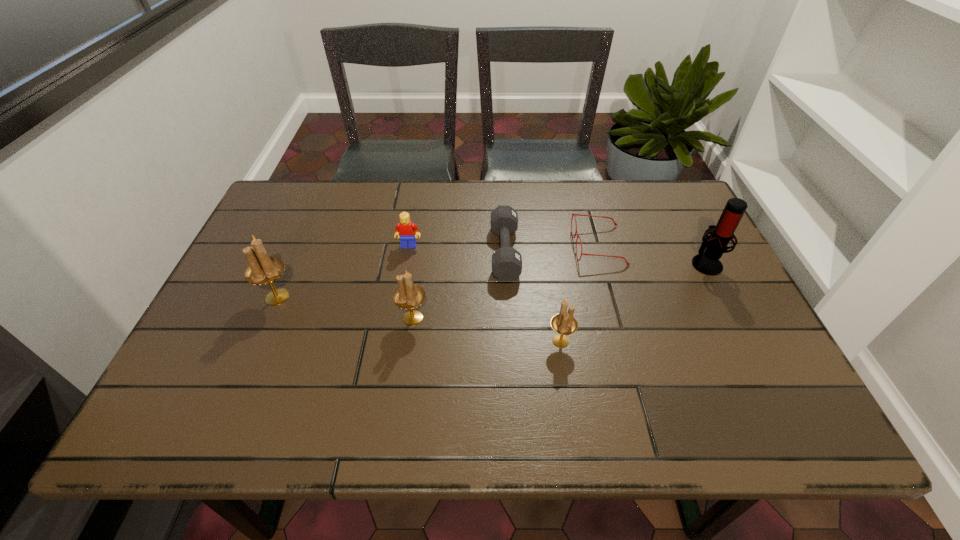
You are a GUI agent. You are given a task and a screenshot of the screen. Output one action in this format:
    pyautogui.click(x=<x>, y=<y>)
    Task: Click on the vacant space that is in between the shortest object and the rightmost object
    The width and height of the screenshot is (960, 540).
    Given the screenshot: What is the action you would take?
    pyautogui.click(x=652, y=254)

This screenshot has height=540, width=960. Find the location of `empty space between the second tallest candle holder and the shortest candle holder`. empty space between the second tallest candle holder and the shortest candle holder is located at coordinates (487, 329).

Locate an element on the screen. The width and height of the screenshot is (960, 540). unoccupied position between the dumbbell and the Lego is located at coordinates (457, 248).

This screenshot has height=540, width=960. I want to click on vacant space that is in between the fourth object from left to right and the rightmost object, so click(x=606, y=257).

The image size is (960, 540). I want to click on unoccupied position between the leftmost object and the shortest object, so click(x=438, y=272).

This screenshot has height=540, width=960. I want to click on vacant space that is in between the second object from right to left and the dumbbell, so click(x=552, y=249).

Identify the location of free space that is in between the shortest candle holder and the dumbbell. The width and height of the screenshot is (960, 540). (533, 296).

Identify the location of free point between the sixth tallest object and the third object from right to left. Image resolution: width=960 pixels, height=540 pixels. (533, 296).

I want to click on vacant space that is in between the second candle holder from right to left and the fourth object from left to right, so click(459, 285).

Select which object is the sixth closest to the leftmost candle holder. Please provide its 2D coordinates. Your answer should be formatted as a tuple, i.e. [(x, y)], where the tuple contains the x and y coordinates of a point satisfying the conditions above.

[(713, 246)]